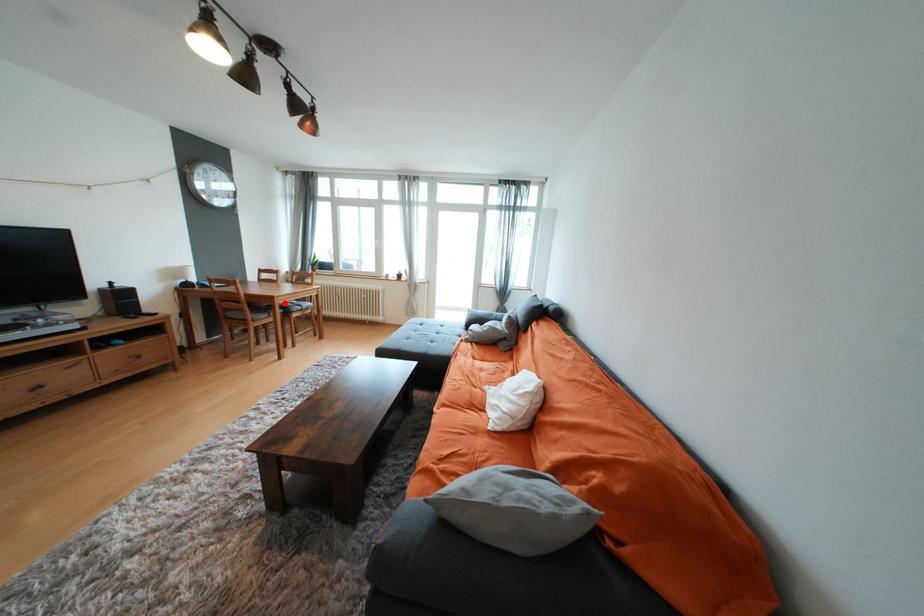
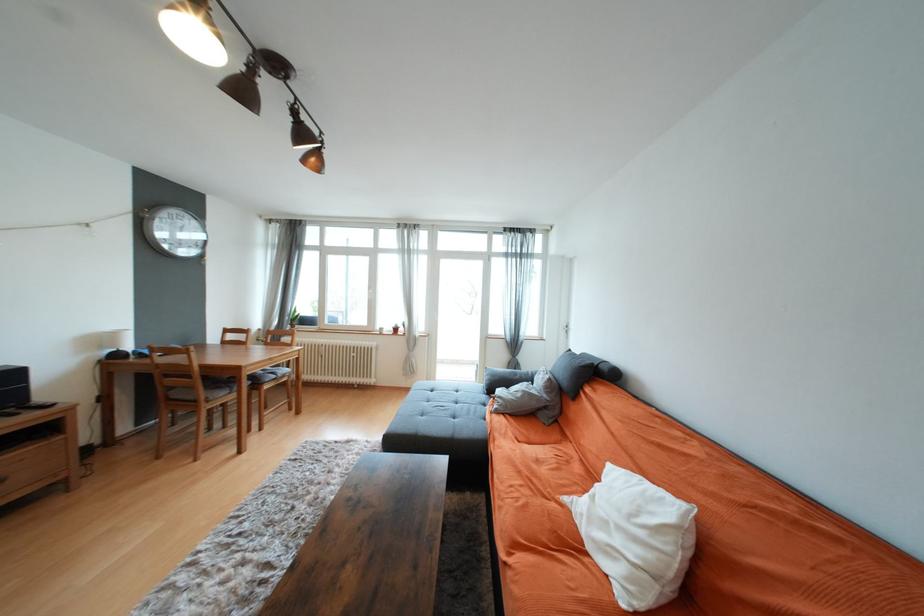
Question: I am providing you with two images of the same scene from different viewpoints. In image1, a red point is highlighted. Considering the same 3D point in image2, which of the following is correct?

Choices:
 (A) It is closer
 (B) It is farther

Answer: (A)